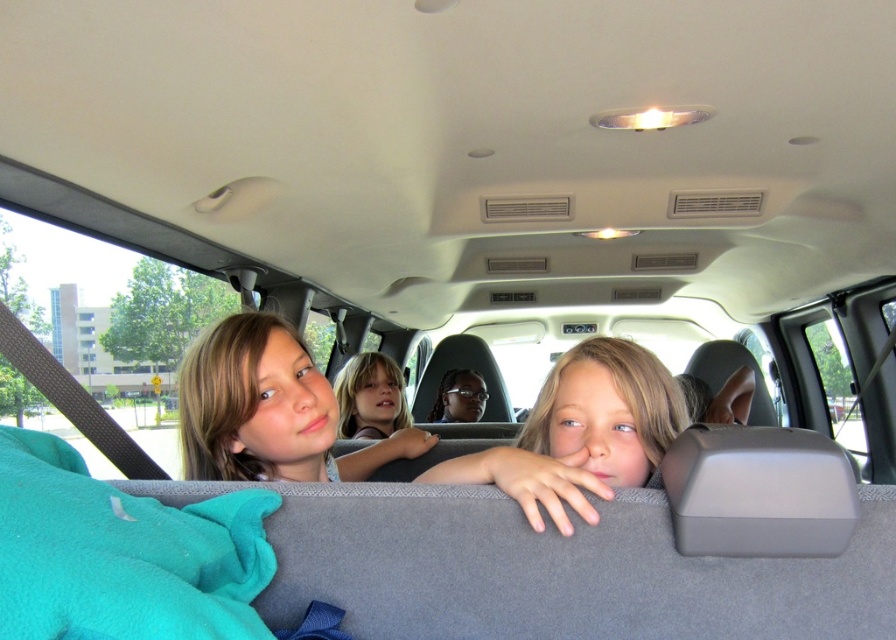
Question: Which of the following is the farthest from the observer?

Choices:
 (A) blonde hair at center
 (B) smooth skin face at center

Answer: (B)

Question: Where is blonde hair at center located in relation to smooth skin face at center in the image?

Choices:
 (A) above
 (B) below

Answer: (A)

Question: Which object appears farthest from the camera in this image?

Choices:
 (A) smooth skin face at center
 (B) blonde hair at center

Answer: (A)

Question: Is blonde hair at center closer to camera compared to smooth skin face at center?

Choices:
 (A) yes
 (B) no

Answer: (A)

Question: Which object is farther from the camera taking this photo?

Choices:
 (A) blonde hair at center
 (B) smooth skin face at center

Answer: (B)

Question: Can you confirm if blonde hair at center is wider than smooth skin face at center?

Choices:
 (A) no
 (B) yes

Answer: (B)